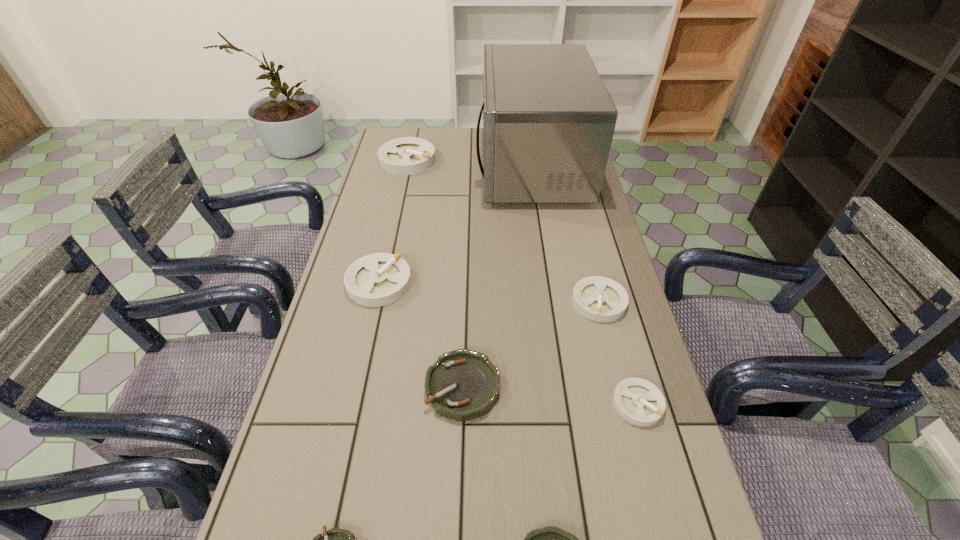
This screenshot has width=960, height=540. What are the coordinates of `the tallest object` in the screenshot? It's located at (548, 120).

The height and width of the screenshot is (540, 960). In order to click on the seventh shortest object in this screenshot , I will do `click(409, 155)`.

Where is `the tallest ashtray`? The height and width of the screenshot is (540, 960). the tallest ashtray is located at coordinates (409, 155).

Image resolution: width=960 pixels, height=540 pixels. Find the location of `the sixth shortest object`. the sixth shortest object is located at coordinates (379, 279).

This screenshot has height=540, width=960. I want to click on the sixth shortest ashtray, so click(x=379, y=279).

What are the coordinates of `the second smallest gray ashtray` in the screenshot? It's located at (601, 299).

You are a GUI agent. You are given a task and a screenshot of the screen. Output one action in this format:
    pyautogui.click(x=<x>, y=<y>)
    Task: Click on the fifth shortest ashtray
    The image size is (960, 540).
    Given the screenshot: What is the action you would take?
    pyautogui.click(x=601, y=299)

The width and height of the screenshot is (960, 540). What are the coordinates of `the fourth ashtray from left to right` in the screenshot? It's located at (463, 384).

Where is `the second green ashtray from right to left`? The image size is (960, 540). the second green ashtray from right to left is located at coordinates (463, 384).

Find the location of `the nearest gray ashtray`. the nearest gray ashtray is located at coordinates (638, 401).